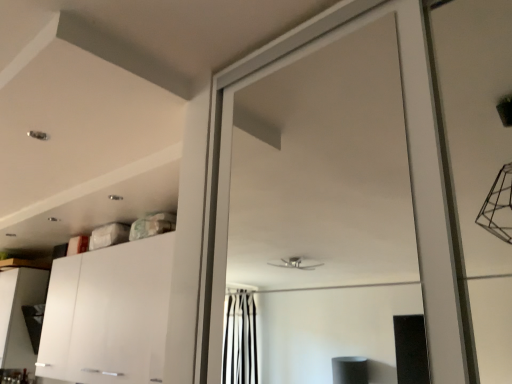
Question: Is white glossy cabinet at lower left, the first cabinetry positioned from the front, far from white glossy cabinet at lower left, the second cabinetry when ordered from right to left?

Choices:
 (A) no
 (B) yes

Answer: (A)

Question: From a real-world perspective, is white glossy cabinet at lower left, placed as the second cabinetry when sorted from back to front, below white glossy cabinet at lower left, the second cabinetry when ordered from front to back?

Choices:
 (A) yes
 (B) no

Answer: (B)

Question: Is white glossy cabinet at lower left, the 1th cabinetry viewed from the back, inside white glossy cabinet at lower left, placed as the second cabinetry when sorted from back to front?

Choices:
 (A) yes
 (B) no

Answer: (B)

Question: Is white glossy cabinet at lower left, placed as the second cabinetry when sorted from back to front, positioned behind white glossy cabinet at lower left, the 1th cabinetry viewed from the back?

Choices:
 (A) no
 (B) yes

Answer: (A)

Question: Can you confirm if white glossy cabinet at lower left, which is the first cabinetry from right to left, is taller than white glossy cabinet at lower left, the 1th cabinetry viewed from the left?

Choices:
 (A) no
 (B) yes

Answer: (B)

Question: Is white glossy cabinet at lower left, which is the first cabinetry from right to left, touching white glossy cabinet at lower left, the 1th cabinetry viewed from the back?

Choices:
 (A) yes
 (B) no

Answer: (B)

Question: Is white glossy cabinet at lower left, which is the second cabinetry from left to right, inside white glossy cabinet at lower left, the 1th cabinetry viewed from the left?

Choices:
 (A) no
 (B) yes

Answer: (A)

Question: From the image's perspective, is white glossy cabinet at lower left, the second cabinetry when ordered from right to left, located beneath white glossy cabinet at lower left, which is the second cabinetry from left to right?

Choices:
 (A) yes
 (B) no

Answer: (A)

Question: Can we say white glossy cabinet at lower left, the 1th cabinetry viewed from the back, lies outside white glossy cabinet at lower left, which is the second cabinetry from left to right?

Choices:
 (A) yes
 (B) no

Answer: (A)

Question: Does white glossy cabinet at lower left, the 1th cabinetry viewed from the back, have a greater height compared to white glossy cabinet at lower left, the first cabinetry positioned from the front?

Choices:
 (A) no
 (B) yes

Answer: (A)

Question: Does white glossy cabinet at lower left, the second cabinetry when ordered from front to back, have a larger size compared to white glossy cabinet at lower left, which is the second cabinetry from left to right?

Choices:
 (A) no
 (B) yes

Answer: (A)

Question: From the image's perspective, is white glossy cabinet at lower left, the 1th cabinetry viewed from the left, above white glossy cabinet at lower left, which is the first cabinetry from right to left?

Choices:
 (A) yes
 (B) no

Answer: (B)

Question: Considering the positions of white glossy cabinet at lower left, the second cabinetry when ordered from right to left, and white glossy cabinet at lower left, which is the first cabinetry from right to left, in the image, is white glossy cabinet at lower left, the second cabinetry when ordered from right to left, bigger or smaller than white glossy cabinet at lower left, which is the first cabinetry from right to left,?

Choices:
 (A) small
 (B) big

Answer: (A)